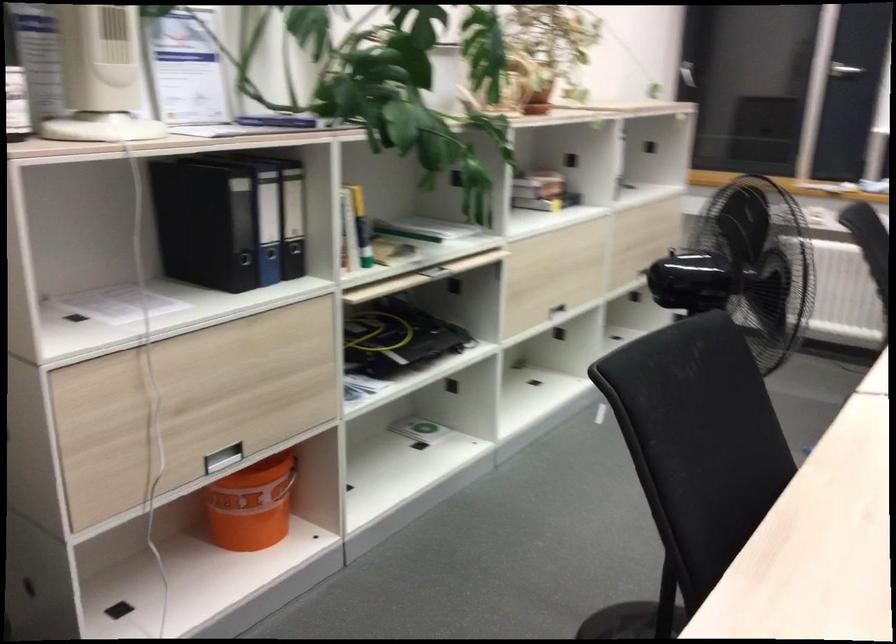
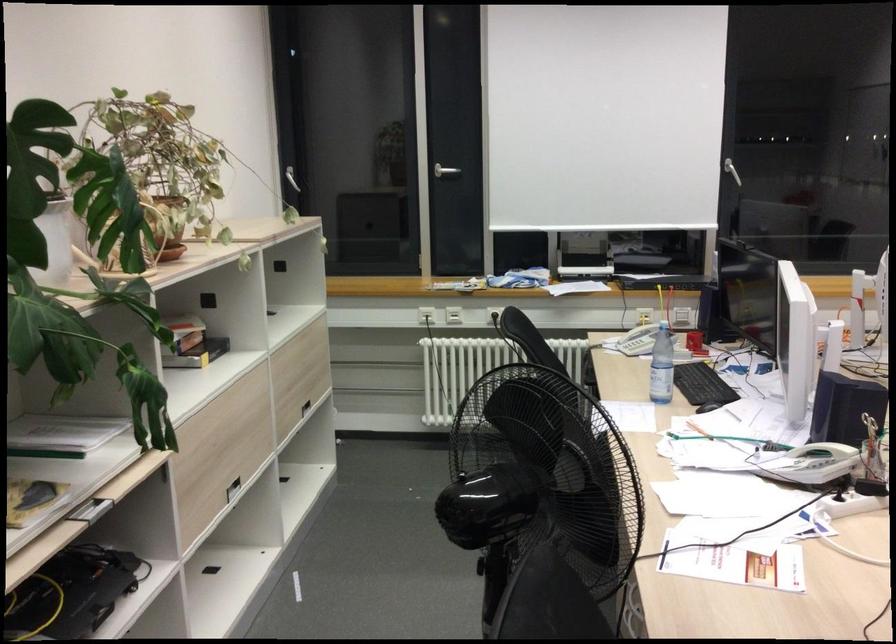
Find the pixel in the second image that matches [541,190] in the first image.

(192, 343)